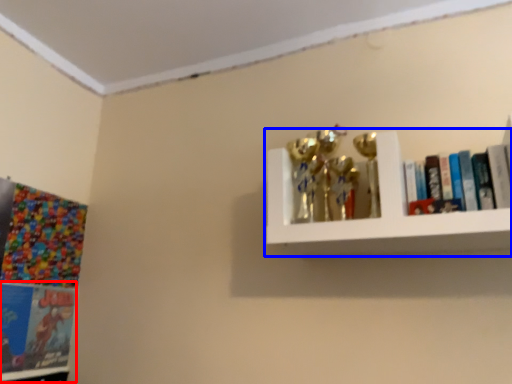
Question: Which point is further to the camera, book (highlighted by a red box) or shelf (highlighted by a blue box)?

Choices:
 (A) book
 (B) shelf

Answer: (A)